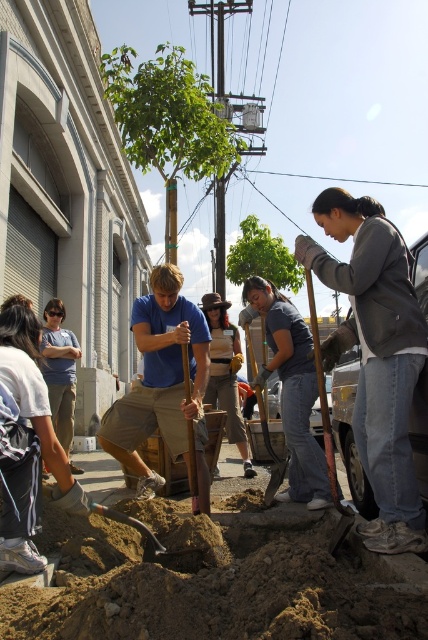
You are a photographer trying to capture a group photo of the community gardening activity. You notice the gray cotton jacket at center and the blue cotton shirt at center. Which clothing item should you adjust to ensure both are fully visible in the photo?

The gray cotton jacket at center is much taller than the blue cotton shirt at center. To ensure both are fully visible, you should adjust the gray cotton jacket at center so it doesn

You are standing at the point labeled as point (x=211, y=588) in the image. Looking around, you see brown sandy soil at lower center. Which direction should you walk to reach the brown sandy soil at lower center?

Since the point (x=211, y=588) is already on the brown sandy soil at lower center, you are already there.

You are a participant in the gardening activity and need to place a small potted plant between the brown sandy soil at lower center and the denim jacket at lower left. Which object should the plant be closer to if you want it to be near the larger object?

The brown sandy soil at lower center is larger in size than the denim jacket at lower left. Therefore, the small potted plant should be placed closer to the brown sandy soil at lower center to be near the larger object.